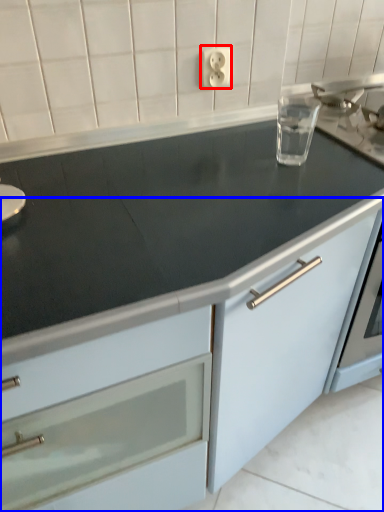
Question: Which point is closer to the camera, electric outlet (highlighted by a red box) or cabinetry (highlighted by a blue box)?

Choices:
 (A) electric outlet
 (B) cabinetry

Answer: (B)